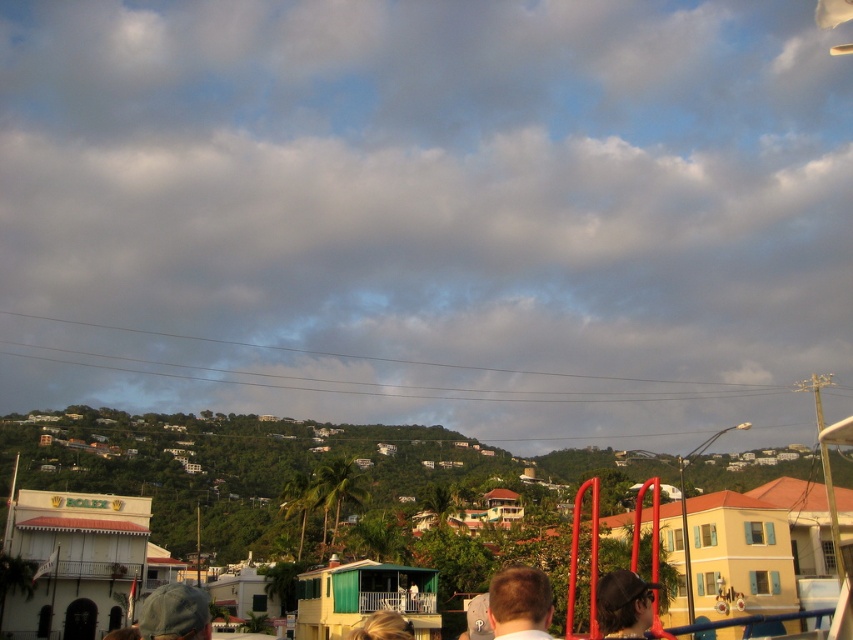
Can you confirm if camouflage fabric cap at lower left is shorter than blonde hair at lower center?

Yes, camouflage fabric cap at lower left is shorter than blonde hair at lower center.

Who is more forward, (x=167, y=625) or (x=392, y=612)?

Point (x=167, y=625) is in front.

Where is `camouflage fabric cap at lower left`? The image size is (853, 640). camouflage fabric cap at lower left is located at coordinates (175, 612).

Is blonde hair at center below blonde hair at lower center?

Incorrect, blonde hair at center is not positioned below blonde hair at lower center.

Between point (508, 596) and point (399, 636), which one is positioned behind?

The point (508, 596) is more distant.

The height and width of the screenshot is (640, 853). In order to click on blonde hair at center in this screenshot , I will do `click(519, 602)`.

Is camouflage fabric cap at lower left below matte black cap at center?

Actually, camouflage fabric cap at lower left is above matte black cap at center.

Is camouflage fabric cap at lower left positioned at the back of matte black cap at center?

That is False.

Is point (167, 624) more distant than point (614, 632)?

That is False.

Locate an element on the screen. This screenshot has width=853, height=640. camouflage fabric cap at lower left is located at coordinates (175, 612).